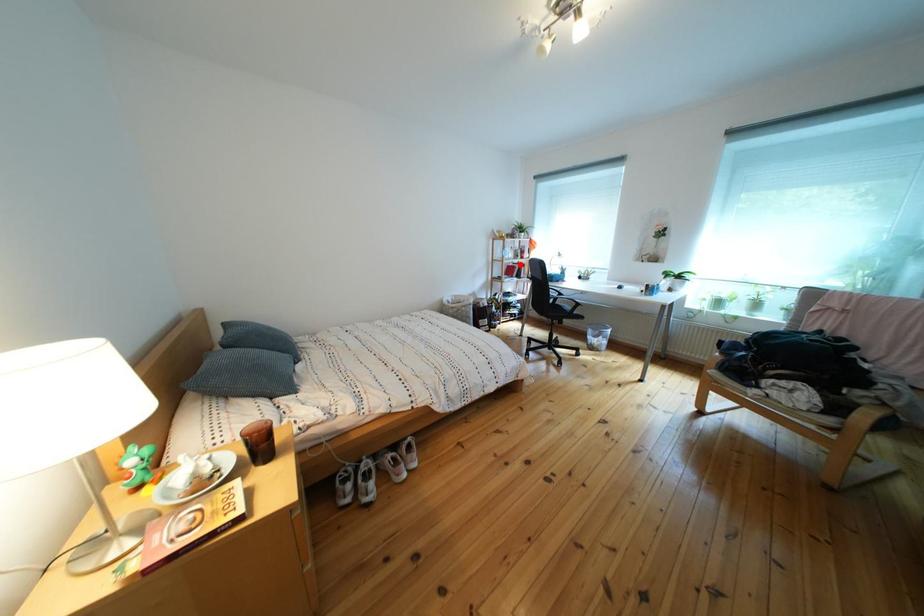
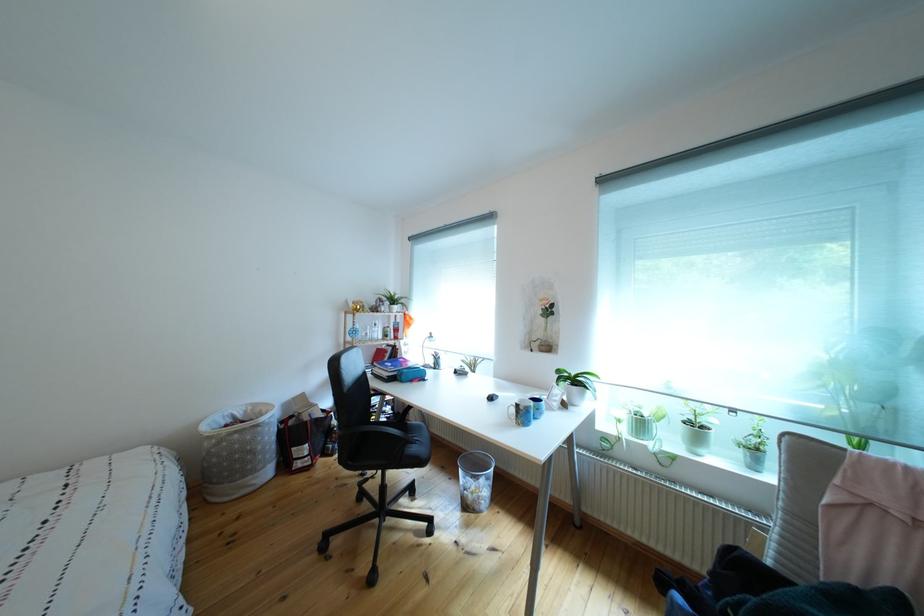
Question: I am providing you with two images of the same scene from different viewpoints. Given a red point in image1, look at the same physical point in image2. Is it:

Choices:
 (A) Closer to the viewpoint
 (B) Farther from the viewpoint

Answer: (B)